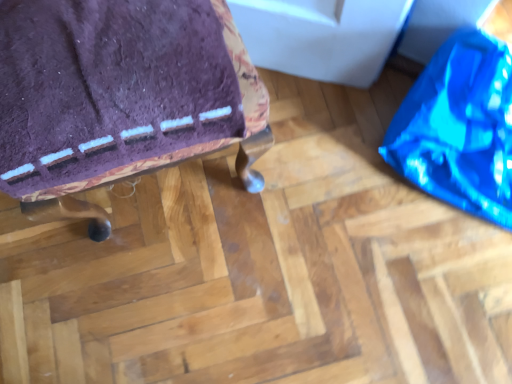
What are the coordinates of `unoccupied area in front of shiny blue bean bag at right` in the screenshot? It's located at (420, 284).